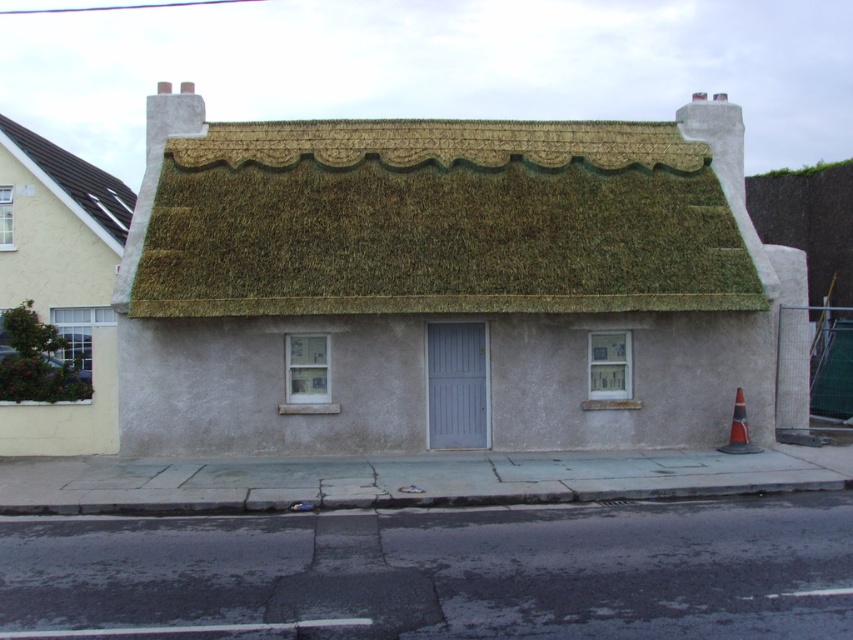
You are standing in front of the house and want to place a decorative flag at the point marked as point [444,285]. Based on the scene description, where exactly on the house would this flag be placed?

The point [444,285] is located on the thatched roof cottage at center, so placing the decorative flag there would position it on the roof of the house.

You are a painter standing at the base of the matte white house at left and want to reach the dark brown shingles at upper left to fix a loose one. You have a ladder that is 5 feet long. Do you think your ladder will be long enough to reach the shingles?

The distance between the matte white house at left and the dark brown shingles at upper left is 5.60 feet. Since the ladder is only 5 feet long, it will be 0.60 feet too short to reach the shingles.

You are standing in front of the house and notice two points marked on its exterior walls. The first point is at coordinate point (517, 157) and the second is at point (62, 161). Which point is closer to you?

Point (517, 157) is closer to the viewer than point (62, 161).